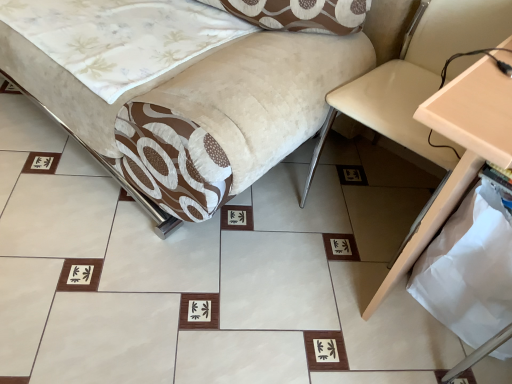
Question: From a real-world perspective, does beige wood table at right stand above beige leather swivel chair at right?

Choices:
 (A) yes
 (B) no

Answer: (A)

Question: Can you confirm if beige wood table at right is positioned to the left of beige leather swivel chair at right?

Choices:
 (A) no
 (B) yes

Answer: (A)

Question: Is beige wood table at right to the right of beige leather swivel chair at right from the viewer's perspective?

Choices:
 (A) no
 (B) yes

Answer: (B)

Question: Does beige wood table at right have a larger size compared to beige leather swivel chair at right?

Choices:
 (A) yes
 (B) no

Answer: (A)

Question: Can you confirm if beige wood table at right is shorter than beige leather swivel chair at right?

Choices:
 (A) no
 (B) yes

Answer: (A)

Question: Does beige wood table at right turn towards beige leather swivel chair at right?

Choices:
 (A) no
 (B) yes

Answer: (A)

Question: Is beige leather swivel chair at right taller than velvet beige sofa at center?

Choices:
 (A) yes
 (B) no

Answer: (A)

Question: Can you confirm if beige leather swivel chair at right is thinner than velvet beige sofa at center?

Choices:
 (A) no
 (B) yes

Answer: (B)

Question: Is beige leather swivel chair at right shorter than velvet beige sofa at center?

Choices:
 (A) no
 (B) yes

Answer: (A)

Question: Is beige leather swivel chair at right touching velvet beige sofa at center?

Choices:
 (A) yes
 (B) no

Answer: (B)

Question: Considering the relative positions of beige leather swivel chair at right and velvet beige sofa at center in the image provided, is beige leather swivel chair at right behind velvet beige sofa at center?

Choices:
 (A) no
 (B) yes

Answer: (B)

Question: Considering the relative positions of beige leather swivel chair at right and velvet beige sofa at center in the image provided, is beige leather swivel chair at right to the left of velvet beige sofa at center from the viewer's perspective?

Choices:
 (A) yes
 (B) no

Answer: (B)

Question: From a real-world perspective, is beige leather swivel chair at right on beige wood table at right?

Choices:
 (A) no
 (B) yes

Answer: (A)